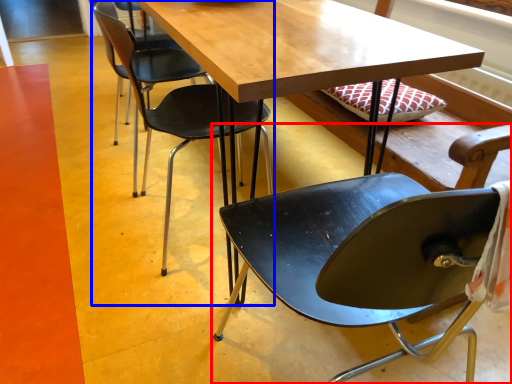
Question: Among these objects, which one is farthest to the camera, chair (highlighted by a red box) or chair (highlighted by a blue box)?

Choices:
 (A) chair
 (B) chair

Answer: (B)